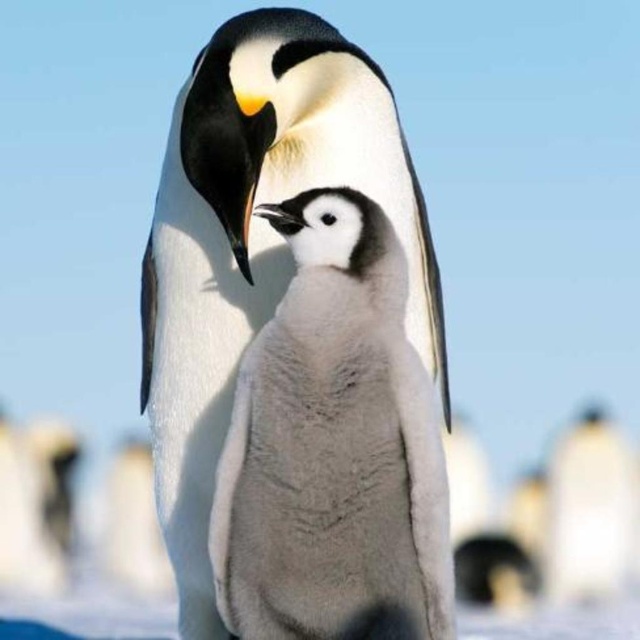
In the scene shown: You are observing two penguins in a snowy habitat. You notice a point at coordinates point (284, 291) and another at point (604, 516). Which point is closer to the viewer?

Point (284, 291) is in front of point (604, 516), so it is closer to the viewer.

You are a wildlife photographer aiming to capture a closeup of the white fluffy penguin at center. You are currently positioned at point (256, 248). Can you take the photo without moving? Explain your reasoning.

Yes, because the white fluffy penguin at center is located exactly at point (256, 248) where you are standing, so you can take the photo without moving.